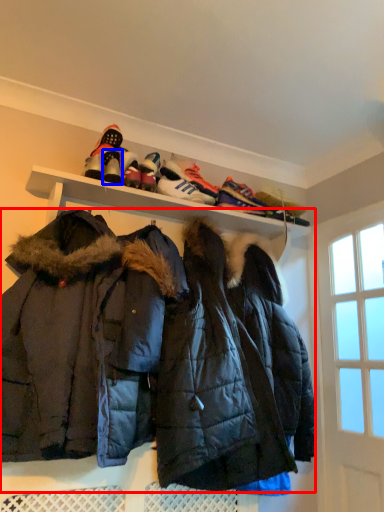
Question: Which point is closer to the camera, jacket (highlighted by a red box) or footwear (highlighted by a blue box)?

Choices:
 (A) jacket
 (B) footwear

Answer: (A)